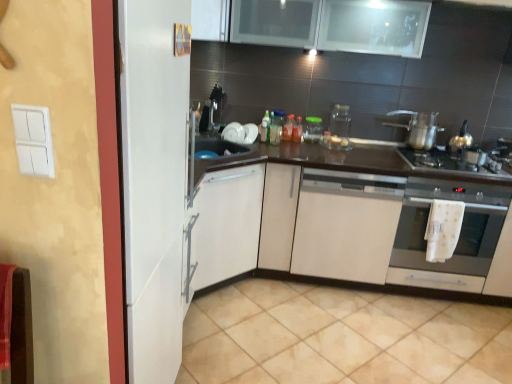
Question: Does gold metallic tea pot at right have a greater height compared to translucent glass jar at center, which is counted as the third bottle, starting from the right?

Choices:
 (A) yes
 (B) no

Answer: (B)

Question: Can you confirm if gold metallic tea pot at right is wider than translucent glass jar at center, the 2th bottle when ordered from left to right?

Choices:
 (A) no
 (B) yes

Answer: (B)

Question: From the image's perspective, would you say gold metallic tea pot at right is shown under translucent glass jar at center, the 2th bottle when ordered from left to right?

Choices:
 (A) yes
 (B) no

Answer: (A)

Question: Is gold metallic tea pot at right facing away from translucent glass jar at center, which is counted as the third bottle, starting from the right?

Choices:
 (A) yes
 (B) no

Answer: (B)

Question: Is gold metallic tea pot at right to the right of translucent glass jar at center, which is counted as the third bottle, starting from the right, from the viewer's perspective?

Choices:
 (A) no
 (B) yes

Answer: (B)

Question: From a real-world perspective, does gold metallic tea pot at right stand above translucent glass jar at center, which is counted as the third bottle, starting from the right?

Choices:
 (A) no
 (B) yes

Answer: (B)

Question: Is the position of transparent glass jar at center, placed as the 2th appliance when sorted from left to right, more distant than that of satin silver oven at lower right?

Choices:
 (A) yes
 (B) no

Answer: (A)

Question: Does transparent glass jar at center, which is the second appliance from right to left, have a smaller size compared to satin silver oven at lower right?

Choices:
 (A) yes
 (B) no

Answer: (A)

Question: Considering the relative sizes of transparent glass jar at center, which is the second appliance from right to left, and satin silver oven at lower right in the image provided, is transparent glass jar at center, which is the second appliance from right to left, shorter than satin silver oven at lower right?

Choices:
 (A) yes
 (B) no

Answer: (A)

Question: Can you confirm if transparent glass jar at center, which is the second appliance from right to left, is taller than satin silver oven at lower right?

Choices:
 (A) no
 (B) yes

Answer: (A)

Question: Considering the relative positions of transparent glass jar at center, which is the second appliance from right to left, and satin silver oven at lower right in the image provided, is transparent glass jar at center, which is the second appliance from right to left, to the left of satin silver oven at lower right from the viewer's perspective?

Choices:
 (A) yes
 (B) no

Answer: (A)

Question: Is transparent glass jar at center, placed as the 2th appliance when sorted from left to right, far from satin silver oven at lower right?

Choices:
 (A) yes
 (B) no

Answer: (A)

Question: Is translucent plastic bottle at center, the 1th bottle viewed from the right, to the left of translucent glass jar at center, the 2th bottle when ordered from left to right, from the viewer's perspective?

Choices:
 (A) yes
 (B) no

Answer: (B)